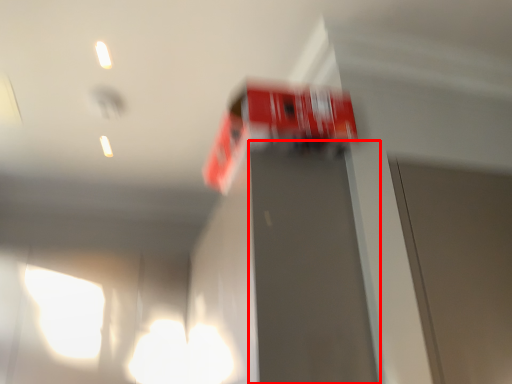
Question: From the image's perspective, considering the relative positions of elevator door (annotated by the red box) and vehicle in the image provided, where is elevator door (annotated by the red box) located with respect to the staircase?

Choices:
 (A) above
 (B) below

Answer: (B)